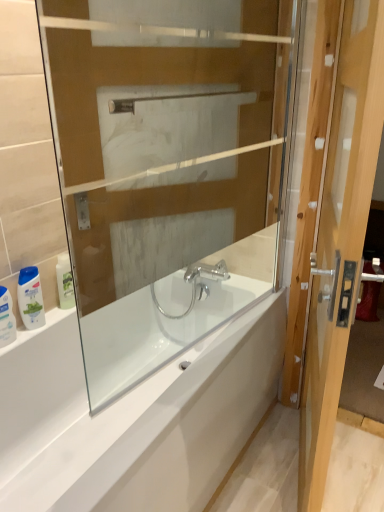
Identify the location of transparent glass bathtub at center. This screenshot has height=512, width=384. (166, 168).

The image size is (384, 512). What do you see at coordinates (6, 318) in the screenshot?
I see `white glossy bottle at lower left, which appears as the first toiletry when viewed from the left` at bounding box center [6, 318].

Describe the element at coordinates (30, 298) in the screenshot. I see `white glossy shampoo bottle at lower left, which appears as the 2th toiletry when viewed from the right` at that location.

I want to click on transparent glass bathtub at center, so 166,168.

From the image's perspective, between white glossy bottle at left, arranged as the first toiletry when viewed from the right, and light brown wooden door at right, which one is located above?

From the image's view, white glossy bottle at left, arranged as the first toiletry when viewed from the right, is above.

Is white glossy bottle at left, which is the third toiletry in left-to-right order, to the right of light brown wooden door at right from the viewer's perspective?

Incorrect, white glossy bottle at left, which is the third toiletry in left-to-right order, is not on the right side of light brown wooden door at right.

Which of these two, white glossy bottle at left, arranged as the first toiletry when viewed from the right, or light brown wooden door at right, is thinner?

Thinner between the two is white glossy bottle at left, arranged as the first toiletry when viewed from the right.

Does point (70, 279) appear closer or farther from the camera than point (347, 53)?

Point (70, 279) is farther from the camera than point (347, 53).

From the image's perspective, which is below, white glossy bottle at left, which is the third toiletry in left-to-right order, or transparent glass bathtub at center?

white glossy bottle at left, which is the third toiletry in left-to-right order, appears lower in the image.

In the scene shown: Considering the sizes of objects white glossy bottle at left, which is the third toiletry in left-to-right order, and transparent glass bathtub at center in the image provided, who is bigger, white glossy bottle at left, which is the third toiletry in left-to-right order, or transparent glass bathtub at center?

Bigger between the two is transparent glass bathtub at center.

Based on their positions, is white glossy bottle at left, which is the third toiletry in left-to-right order, located to the left or right of transparent glass bathtub at center?

Based on their positions, white glossy bottle at left, which is the third toiletry in left-to-right order, is located to the left of transparent glass bathtub at center.

Is white glossy bottle at left, which is the third toiletry in left-to-right order, positioned with its back to transparent glass bathtub at center?

white glossy bottle at left, which is the third toiletry in left-to-right order, does not have its back to transparent glass bathtub at center.

From the picture: Are transparent glass bathtub at center and light brown wooden door at right far apart?

They are positioned close to each other.

Would you say transparent glass bathtub at center is inside or outside light brown wooden door at right?

transparent glass bathtub at center is not inside light brown wooden door at right, it's outside.

Does transparent glass bathtub at center have a greater width compared to light brown wooden door at right?

In fact, transparent glass bathtub at center might be narrower than light brown wooden door at right.

Relative to white glossy shampoo bottle at lower left, which appears as the 2th toiletry when viewed from the right, is white glossy bottle at left, arranged as the first toiletry when viewed from the right, in front or behind?

Visually, white glossy bottle at left, arranged as the first toiletry when viewed from the right, is located behind white glossy shampoo bottle at lower left, which appears as the 2th toiletry when viewed from the right.

Which of these two, white glossy bottle at left, which is the third toiletry in left-to-right order, or white glossy shampoo bottle at lower left, which appears as the 2th toiletry when viewed from the right, is smaller?

white glossy bottle at left, which is the third toiletry in left-to-right order, is smaller.

Considering the relative positions of white glossy bottle at left, arranged as the first toiletry when viewed from the right, and white glossy shampoo bottle at lower left, the second toiletry viewed from the left, in the image provided, is white glossy bottle at left, arranged as the first toiletry when viewed from the right, to the left or to the right of white glossy shampoo bottle at lower left, the second toiletry viewed from the left,?

In the image, white glossy bottle at left, arranged as the first toiletry when viewed from the right, appears on the right side of white glossy shampoo bottle at lower left, the second toiletry viewed from the left.

Choose the correct answer: Is white glossy bottle at left, arranged as the first toiletry when viewed from the right, inside white glossy shampoo bottle at lower left, the second toiletry viewed from the left, or outside it?

white glossy bottle at left, arranged as the first toiletry when viewed from the right, cannot be found inside white glossy shampoo bottle at lower left, the second toiletry viewed from the left.

What's the angular difference between light brown wooden door at right and white glossy shampoo bottle at lower left, the second toiletry viewed from the left,'s facing directions?

The angle between the facing direction of light brown wooden door at right and the facing direction of white glossy shampoo bottle at lower left, the second toiletry viewed from the left, is 19 degrees.

Is light brown wooden door at right not near white glossy shampoo bottle at lower left, which appears as the 2th toiletry when viewed from the right?

light brown wooden door at right is far away from white glossy shampoo bottle at lower left, which appears as the 2th toiletry when viewed from the right.

Considering the relative sizes of light brown wooden door at right and white glossy shampoo bottle at lower left, which appears as the 2th toiletry when viewed from the right, in the image provided, is light brown wooden door at right bigger than white glossy shampoo bottle at lower left, which appears as the 2th toiletry when viewed from the right,?

Indeed, light brown wooden door at right has a larger size compared to white glossy shampoo bottle at lower left, which appears as the 2th toiletry when viewed from the right.

Identify the location of door above the white glossy shampoo bottle at lower left, which appears as the 2th toiletry when viewed from the right (from a real-world perspective). The image size is (384, 512). pyautogui.click(x=340, y=234).

Is white glossy bottle at lower left, which ranks as the 3th toiletry in right-to-left order, oriented away from white glossy bathtub at center?

No, white glossy bottle at lower left, which ranks as the 3th toiletry in right-to-left order,'s orientation is not away from white glossy bathtub at center.

Can you confirm if white glossy bottle at lower left, which ranks as the 3th toiletry in right-to-left order, is thinner than white glossy bathtub at center?

Correct, the width of white glossy bottle at lower left, which ranks as the 3th toiletry in right-to-left order, is less than that of white glossy bathtub at center.

Is white glossy bottle at lower left, which ranks as the 3th toiletry in right-to-left order, situated inside white glossy bathtub at center or outside?

white glossy bottle at lower left, which ranks as the 3th toiletry in right-to-left order, is located beyond the bounds of white glossy bathtub at center.

Between white glossy shampoo bottle at lower left, the second toiletry viewed from the left, and light brown wooden door at right, which one has larger size?

light brown wooden door at right.

From the image's perspective, would you say white glossy shampoo bottle at lower left, which appears as the 2th toiletry when viewed from the right, is shown under light brown wooden door at right?

Yes.

From a real-world perspective, which is physically below, white glossy shampoo bottle at lower left, the second toiletry viewed from the left, or light brown wooden door at right?

white glossy shampoo bottle at lower left, the second toiletry viewed from the left.

Would you say white glossy shampoo bottle at lower left, which appears as the 2th toiletry when viewed from the right, contains light brown wooden door at right?

Actually, light brown wooden door at right is outside white glossy shampoo bottle at lower left, which appears as the 2th toiletry when viewed from the right.

Which toiletry is the 3rd one when counting from the back of the light brown wooden door at right? Please provide its 2D coordinates.

[(65, 282)]

Locate an element on the screen. This screenshot has height=512, width=384. glass box in front of the white glossy bottle at left, which is the third toiletry in left-to-right order is located at coordinates (166, 168).

Estimate the real-world distances between objects in this image. Which object is further from light brown wooden door at right, white glossy bottle at left, which is the third toiletry in left-to-right order, or white glossy bathtub at center?

white glossy bottle at left, which is the third toiletry in left-to-right order, is further to light brown wooden door at right.

Looking at this image, which object lies nearer to the anchor point white glossy shampoo bottle at lower left, which appears as the 2th toiletry when viewed from the right, light brown wooden door at right or white glossy bathtub at center?

white glossy bathtub at center.

From the image, which object appears to be farther from white glossy bottle at lower left, which appears as the first toiletry when viewed from the left, white glossy bottle at left, which is the third toiletry in left-to-right order, or light brown wooden door at right?

The object further to white glossy bottle at lower left, which appears as the first toiletry when viewed from the left, is light brown wooden door at right.

From the image, which object appears to be nearer to white glossy bottle at left, arranged as the first toiletry when viewed from the right, white glossy bathtub at center or light brown wooden door at right?

The object closer to white glossy bottle at left, arranged as the first toiletry when viewed from the right, is white glossy bathtub at center.

When comparing their distances from light brown wooden door at right, does white glossy bathtub at center or white glossy shampoo bottle at lower left, the second toiletry viewed from the left, seem further?

white glossy shampoo bottle at lower left, the second toiletry viewed from the left, is positioned further to the anchor light brown wooden door at right.

Considering their positions, is white glossy shampoo bottle at lower left, the second toiletry viewed from the left, positioned closer to light brown wooden door at right than white glossy bottle at lower left, which appears as the first toiletry when viewed from the left?

white glossy shampoo bottle at lower left, the second toiletry viewed from the left, lies closer to light brown wooden door at right than the other object.

When comparing their distances from white glossy shampoo bottle at lower left, the second toiletry viewed from the left, does transparent glass bathtub at center or light brown wooden door at right seem further?

light brown wooden door at right is further to white glossy shampoo bottle at lower left, the second toiletry viewed from the left.

Considering their positions, is light brown wooden door at right positioned further to white glossy bottle at lower left, which appears as the first toiletry when viewed from the left, than white glossy shampoo bottle at lower left, which appears as the 2th toiletry when viewed from the right?

light brown wooden door at right is further to white glossy bottle at lower left, which appears as the first toiletry when viewed from the left.

Locate an element on the screen. glass box between white glossy bottle at lower left, which ranks as the 3th toiletry in right-to-left order, and light brown wooden door at right is located at coordinates (166, 168).

Where is `bathtub between white glossy bottle at lower left, which appears as the first toiletry when viewed from the left, and light brown wooden door at right`? bathtub between white glossy bottle at lower left, which appears as the first toiletry when viewed from the left, and light brown wooden door at right is located at coordinates (133, 418).

This screenshot has height=512, width=384. Identify the location of bathtub between transparent glass bathtub at center and white glossy shampoo bottle at lower left, which appears as the 2th toiletry when viewed from the right, along the z-axis. [133, 418].

The height and width of the screenshot is (512, 384). Find the location of `glass box situated between white glossy shampoo bottle at lower left, the second toiletry viewed from the left, and light brown wooden door at right from left to right`. glass box situated between white glossy shampoo bottle at lower left, the second toiletry viewed from the left, and light brown wooden door at right from left to right is located at coordinates (166, 168).